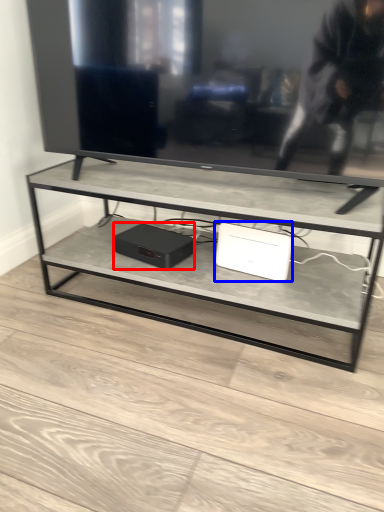
Question: Among these objects, which one is nearest to the camera, computer (highlighted by a red box) or computer (highlighted by a blue box)?

Choices:
 (A) computer
 (B) computer

Answer: (B)